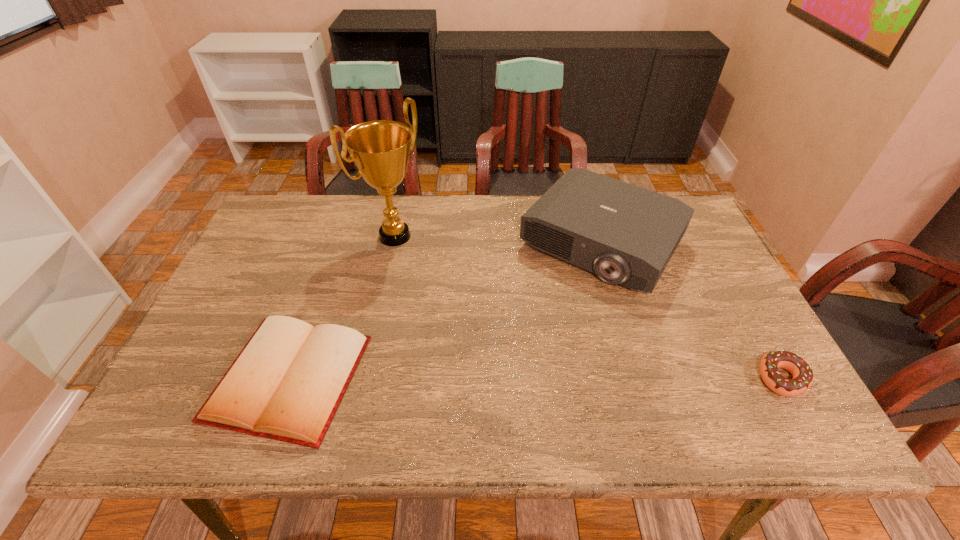
Where is `vacant space situated 0.050m on the front-facing side of the projector`? This screenshot has height=540, width=960. vacant space situated 0.050m on the front-facing side of the projector is located at coordinates (555, 302).

Find the location of a particular element. This screenshot has height=540, width=960. free space located 0.070m on the front-facing side of the projector is located at coordinates (551, 307).

Identify the location of free region located 0.190m on the front-facing side of the projector. This screenshot has width=960, height=540. (528, 338).

I want to click on award that is at the far edge, so click(380, 149).

The height and width of the screenshot is (540, 960). In order to click on projector located in the far edge section of the desktop in this screenshot , I will do `click(626, 234)`.

Where is `Bible that is at the near edge`? This screenshot has width=960, height=540. Bible that is at the near edge is located at coordinates (286, 384).

I want to click on doughnut present at the near edge, so click(x=802, y=373).

At what (x,y) coordinates should I click in order to perform the action: click on object positioned at the left edge. Please return your answer as a coordinate pair (x, y). The height and width of the screenshot is (540, 960). Looking at the image, I should click on (286, 384).

This screenshot has height=540, width=960. I want to click on doughnut that is positioned at the right edge, so click(802, 373).

Locate an element on the screen. The image size is (960, 540). projector that is at the right edge is located at coordinates (626, 234).